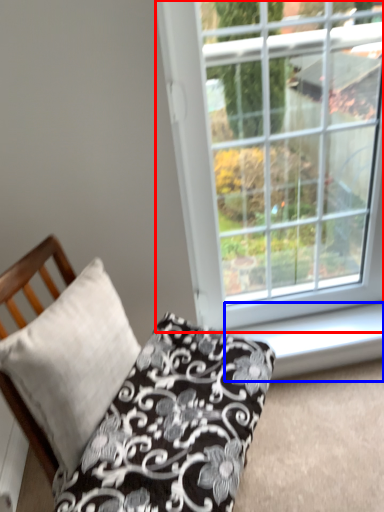
Question: Which of the following is the farthest to the observer, window (highlighted by a red box) or window sill (highlighted by a blue box)?

Choices:
 (A) window
 (B) window sill

Answer: (B)